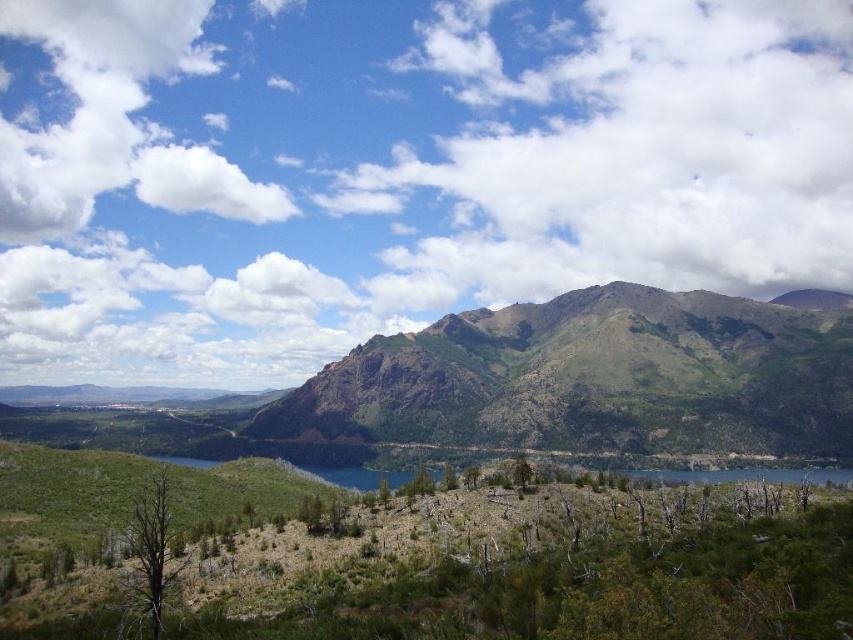
You are a hiker who wants to take a photo of the green textured mountain at center and the white fluffy cloud at upper left. Can you see both in the same frame?

The green textured mountain at center is below the white fluffy cloud at upper left, so yes, you can see both in the same frame as the mountain is positioned lower and the cloud is above it.

You are a drone operator tasked with capturing aerial footage of the mountainous landscape. Your drone has a maximum flight range of 600 meters. If you are positioned at the camera location, can your drone reach the white fluffy cloud at upper center?

The distance between the white fluffy cloud at upper center and the camera is 658.71 meters, which exceeds the drone maximum flight range of 600 meters. Therefore, the drone cannot reach the white fluffy cloud at upper center.

In the scene shown: You are standing at the camera position looking at the mountainous landscape. There are two points marked in the image, one at coordinates point (732, 132) and the other at point (144, 172). Which point is nearer to you?

Point (732, 132) is closer to the camera than point (144, 172), so the point at coordinates point (732, 132) is nearer to you.